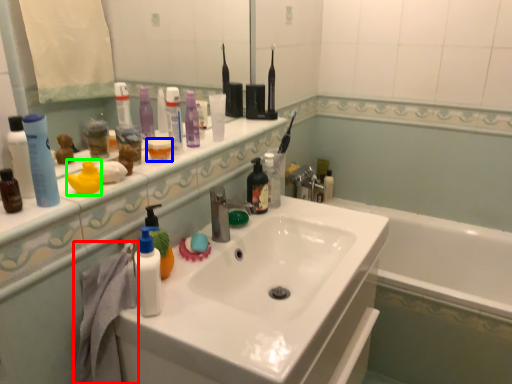
Question: Estimate the real-world distances between objects in this image. Which object is farther from bath towel (highlighted by a red box), mouthwash (highlighted by a blue box) or toiletry (highlighted by a green box)?

Choices:
 (A) mouthwash
 (B) toiletry

Answer: (A)